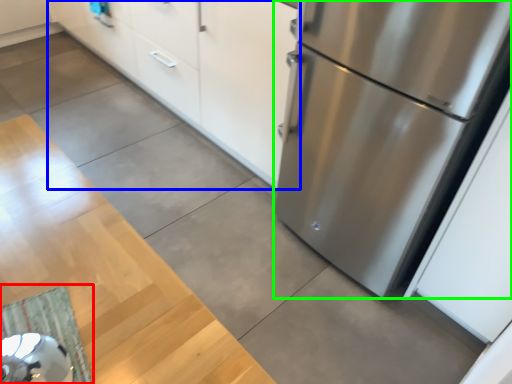
Question: Which object is positioned closest to doormat (highlighted by a red box)? Select from cabinetry (highlighted by a blue box) and refrigerator (highlighted by a green box).

Choices:
 (A) cabinetry
 (B) refrigerator

Answer: (B)